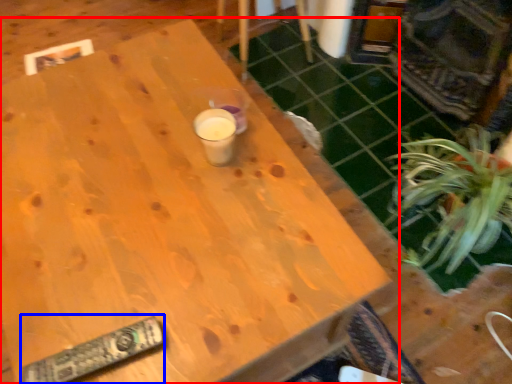
Question: Which point is further to the camera, table (highlighted by a red box) or remote (highlighted by a blue box)?

Choices:
 (A) table
 (B) remote

Answer: (B)